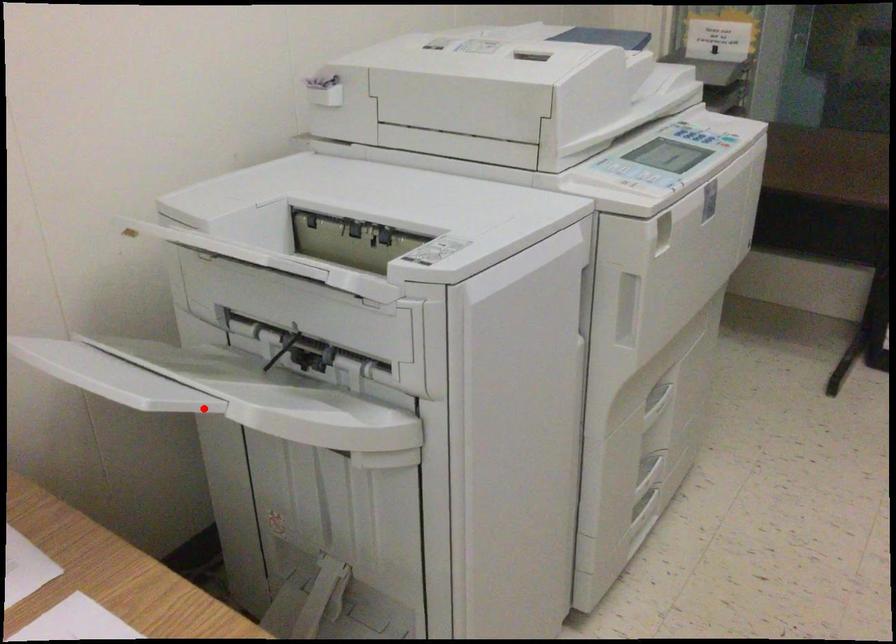
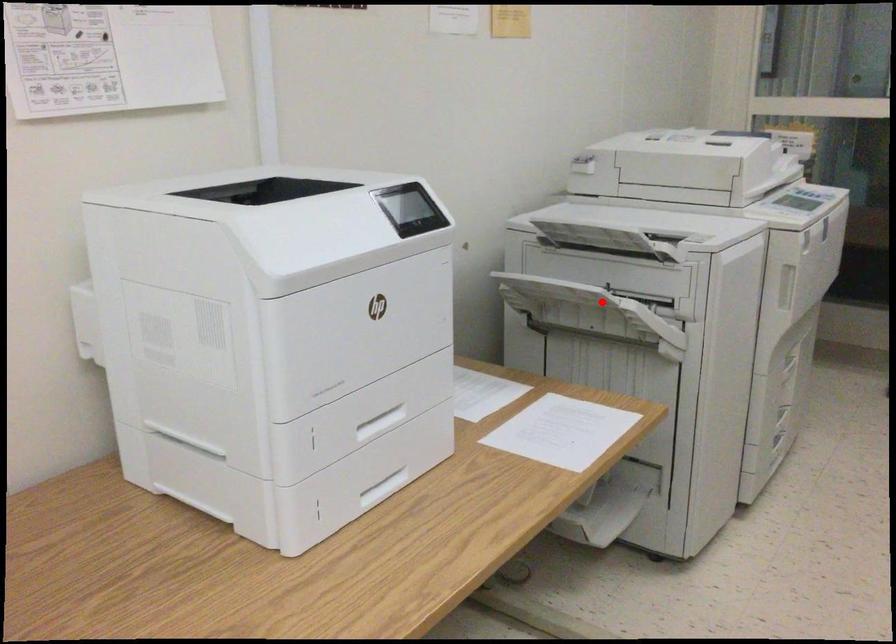
I am providing you with two images of the same scene from different viewpoints. A red point is marked on the first image and another point is marked on the second image. Are the points marked in image1 and image2 representing the same 3D position?

Yes